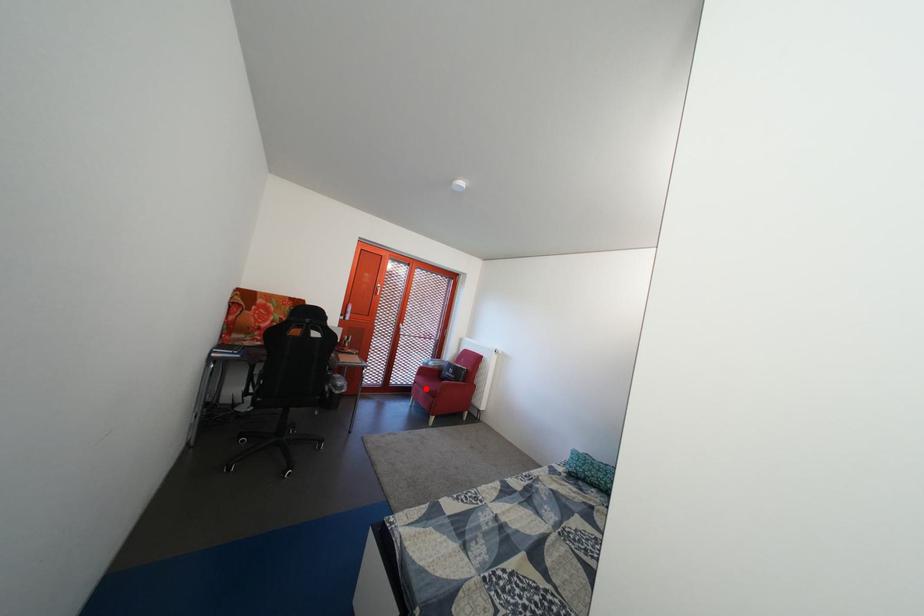
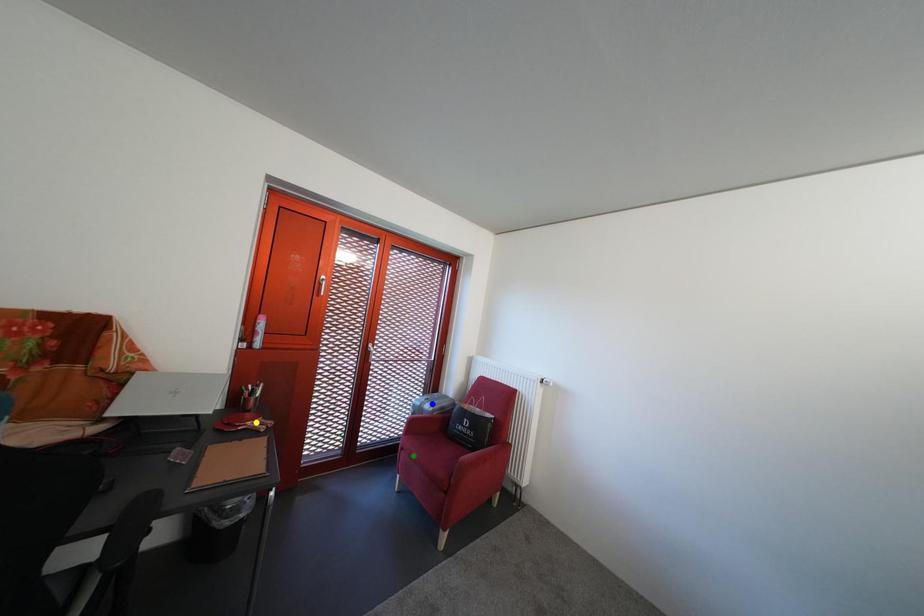
Question: I am providing you with two images of the same scene from different viewpoints. A red point is marked on the first image. You are given multiple points on the second image. Can you choose the point in image 2 that corresponds to the point in image 1?

Choices:
 (A) yellow point
 (B) blue point
 (C) green point

Answer: (C)